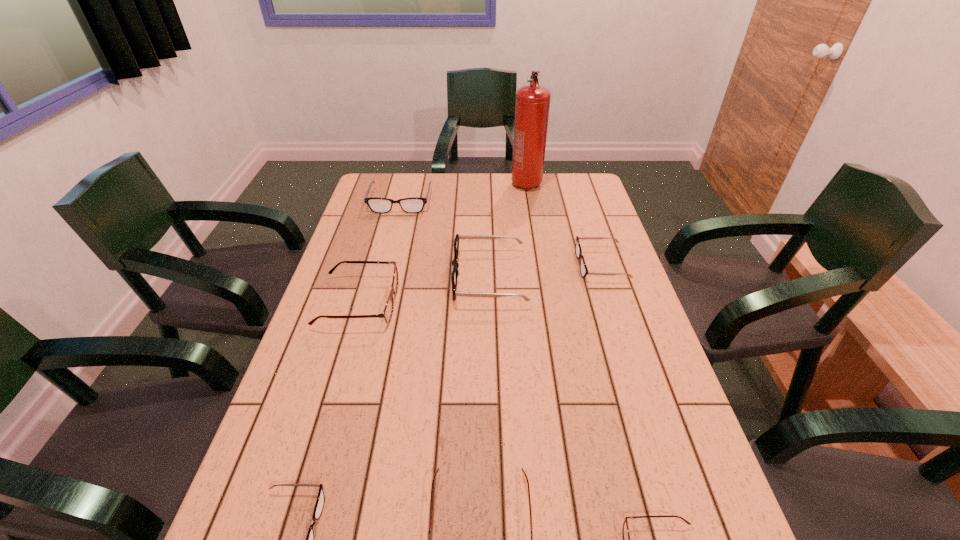
Where is `object at the right edge`? This screenshot has height=540, width=960. object at the right edge is located at coordinates (578, 251).

The image size is (960, 540). I want to click on object that is positioned at the far left corner, so 414,204.

In the image, there is a desktop. Where is `blank space at the far edge`? The height and width of the screenshot is (540, 960). blank space at the far edge is located at coordinates (503, 173).

At what (x,y) coordinates should I click in order to perform the action: click on free space at the left edge of the desktop. Please return your answer as a coordinate pair (x, y). The image size is (960, 540). Looking at the image, I should click on (328, 497).

At what (x,y) coordinates should I click in order to perform the action: click on free space at the right edge of the desktop. Please return your answer as a coordinate pair (x, y). The image size is (960, 540). Looking at the image, I should click on (601, 210).

What are the coordinates of `free space between the third biggest black spectacles and the biggest red spectacles` in the screenshot? It's located at (479, 284).

Find the location of a particular element. The image size is (960, 540). blank region between the third smallest black spectacles and the second smallest black spectacles is located at coordinates point(500,233).

Identify the location of vacant area that lies between the third black spectacles from left to right and the farthest spectacles. The height and width of the screenshot is (540, 960). (444, 240).

Where is `object that ranks as the sixth closest to the nearest black spectacles`? This screenshot has height=540, width=960. object that ranks as the sixth closest to the nearest black spectacles is located at coordinates (414, 204).

Point out which object is positioned as the third nearest to the tallest spectacles. Please provide its 2D coordinates. Your answer should be formatted as a tuple, i.e. [(x, y)], where the tuple contains the x and y coordinates of a point satisfying the conditions above.

[(414, 204)]